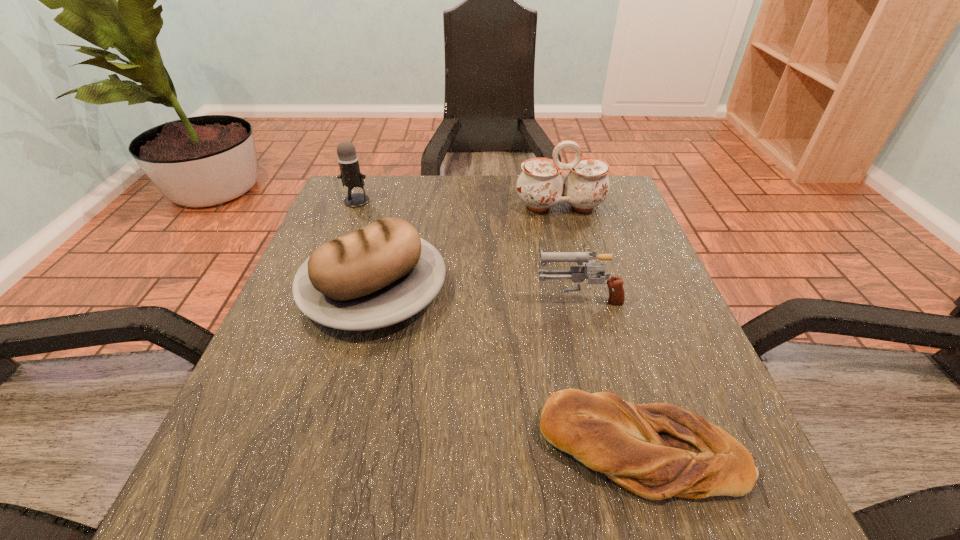
The image size is (960, 540). Find the location of `gun present at the right edge`. gun present at the right edge is located at coordinates coord(578,274).

Locate an element on the screen. bread that is at the right edge is located at coordinates (657, 450).

Find the location of a particular element. object that is at the far left corner is located at coordinates (350, 175).

You are a GUI agent. You are given a task and a screenshot of the screen. Output one action in this format:
    pyautogui.click(x=<x>, y=<y>)
    Task: Click on the object situated at the far right corner
    This screenshot has height=540, width=960.
    Given the screenshot: What is the action you would take?
    pyautogui.click(x=540, y=186)

I want to click on object situated at the near right corner, so click(657, 450).

In the image, there is a desktop. Where is `free space at the far edge`? Image resolution: width=960 pixels, height=540 pixels. free space at the far edge is located at coordinates (489, 207).

This screenshot has height=540, width=960. Identify the location of free space at the near edge of the desktop. (585, 476).

In the image, there is a desktop. Identify the location of vacant space at the left edge. Image resolution: width=960 pixels, height=540 pixels. (309, 249).

Locate an element on the screen. This screenshot has width=960, height=540. free space at the right edge of the desktop is located at coordinates (641, 386).

Image resolution: width=960 pixels, height=540 pixels. What are the coordinates of `vacant space at the far left corner` in the screenshot? It's located at (384, 208).